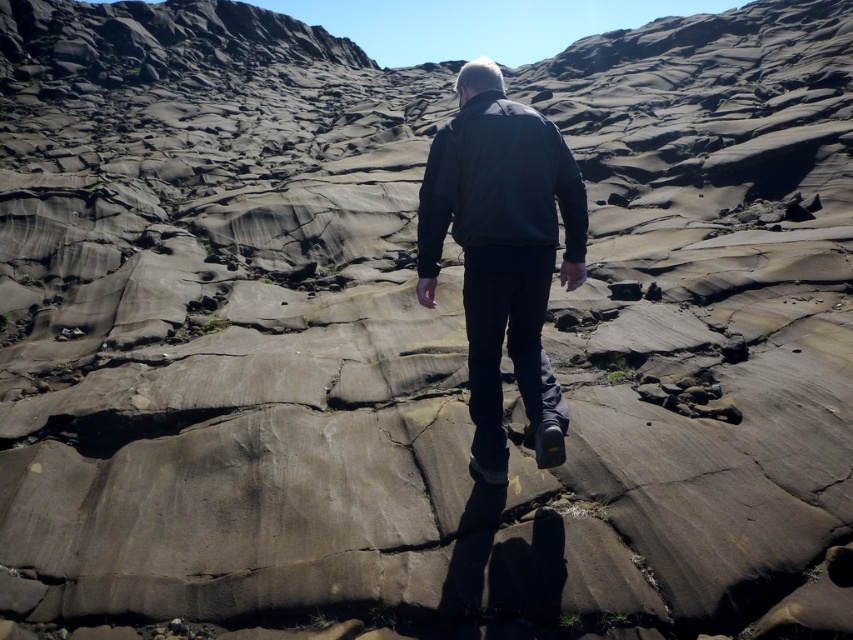
Question: Which of the following is the closest to the observer?

Choices:
 (A) (546, 125)
 (B) (437, 193)

Answer: (B)

Question: Can you confirm if dark gray jacket at center is bigger than dark gray matte jacket at center?

Choices:
 (A) no
 (B) yes

Answer: (B)

Question: Is dark gray jacket at center below dark gray matte jacket at center?

Choices:
 (A) yes
 (B) no

Answer: (A)

Question: Which point is closer to the camera?

Choices:
 (A) (537, 157)
 (B) (566, 160)

Answer: (A)

Question: Is dark gray jacket at center in front of dark gray matte jacket at center?

Choices:
 (A) yes
 (B) no

Answer: (B)